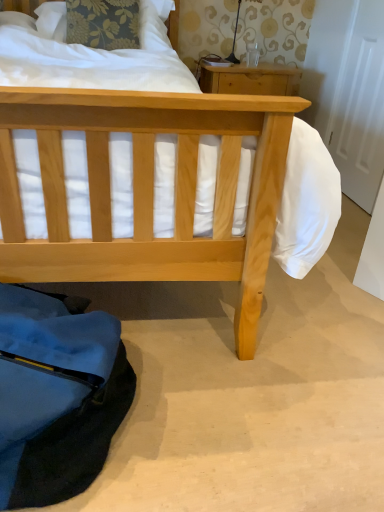
Question: Does matte black lamp at upper center have a lesser width compared to floral fabric pillow at upper left?

Choices:
 (A) yes
 (B) no

Answer: (A)

Question: Can you confirm if matte black lamp at upper center is wider than floral fabric pillow at upper left?

Choices:
 (A) no
 (B) yes

Answer: (A)

Question: From the image's perspective, is matte black lamp at upper center beneath floral fabric pillow at upper left?

Choices:
 (A) yes
 (B) no

Answer: (B)

Question: Is matte black lamp at upper center positioned far away from floral fabric pillow at upper left?

Choices:
 (A) yes
 (B) no

Answer: (B)

Question: From a real-world perspective, is matte black lamp at upper center on top of floral fabric pillow at upper left?

Choices:
 (A) yes
 (B) no

Answer: (A)

Question: Relative to natural wood nightstand at upper center, is matte black lamp at upper center in front or behind?

Choices:
 (A) front
 (B) behind

Answer: (B)

Question: In the image, is matte black lamp at upper center on the left side or the right side of natural wood nightstand at upper center?

Choices:
 (A) right
 (B) left

Answer: (B)

Question: Which is correct: matte black lamp at upper center is inside natural wood nightstand at upper center, or outside of it?

Choices:
 (A) outside
 (B) inside

Answer: (A)

Question: From a real-world perspective, relative to natural wood nightstand at upper center, is matte black lamp at upper center vertically above or below?

Choices:
 (A) below
 (B) above

Answer: (B)

Question: Considering the positions of natural wood nightstand at upper center and matte black lamp at upper center in the image, is natural wood nightstand at upper center wider or thinner than matte black lamp at upper center?

Choices:
 (A) wide
 (B) thin

Answer: (A)

Question: Considering the positions of natural wood nightstand at upper center and matte black lamp at upper center in the image, is natural wood nightstand at upper center bigger or smaller than matte black lamp at upper center?

Choices:
 (A) big
 (B) small

Answer: (A)

Question: Relative to matte black lamp at upper center, is natural wood nightstand at upper center in front or behind?

Choices:
 (A) behind
 (B) front

Answer: (B)

Question: Visually, is natural wood nightstand at upper center positioned to the left or to the right of matte black lamp at upper center?

Choices:
 (A) right
 (B) left

Answer: (A)

Question: Based on their sizes in the image, would you say matte black lamp at upper center is bigger or smaller than floral fabric pillow at upper left?

Choices:
 (A) big
 (B) small

Answer: (B)

Question: From the image's perspective, is matte black lamp at upper center located above or below floral fabric pillow at upper left?

Choices:
 (A) above
 (B) below

Answer: (A)